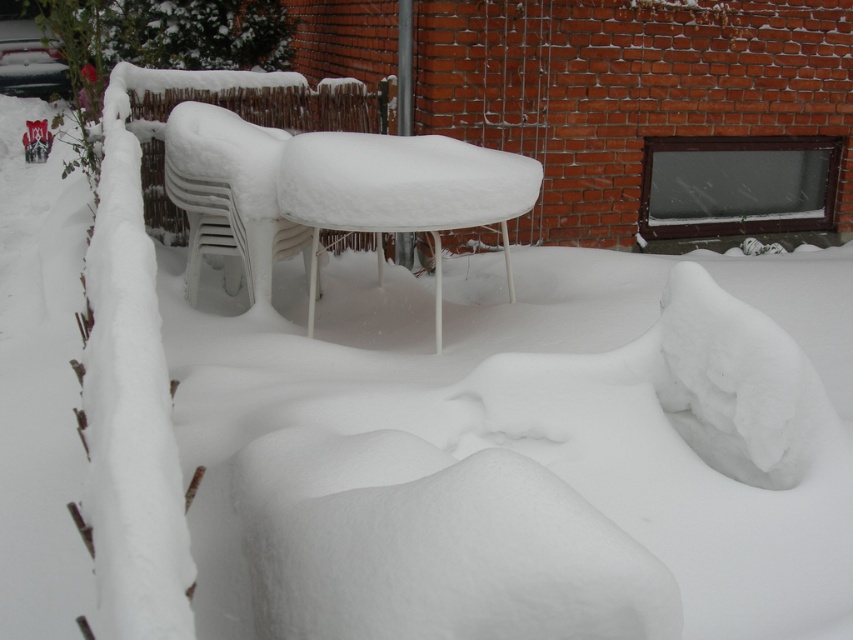
Question: Among these points, which one is farthest from the camera?

Choices:
 (A) pos(213,124)
 (B) pos(438,189)

Answer: (A)

Question: Is white plastic table at center below white plastic chair at center?

Choices:
 (A) no
 (B) yes

Answer: (B)

Question: Is white plastic table at center positioned before white plastic chair at center?

Choices:
 (A) no
 (B) yes

Answer: (B)

Question: Is white plastic table at center above white plastic chair at center?

Choices:
 (A) no
 (B) yes

Answer: (A)